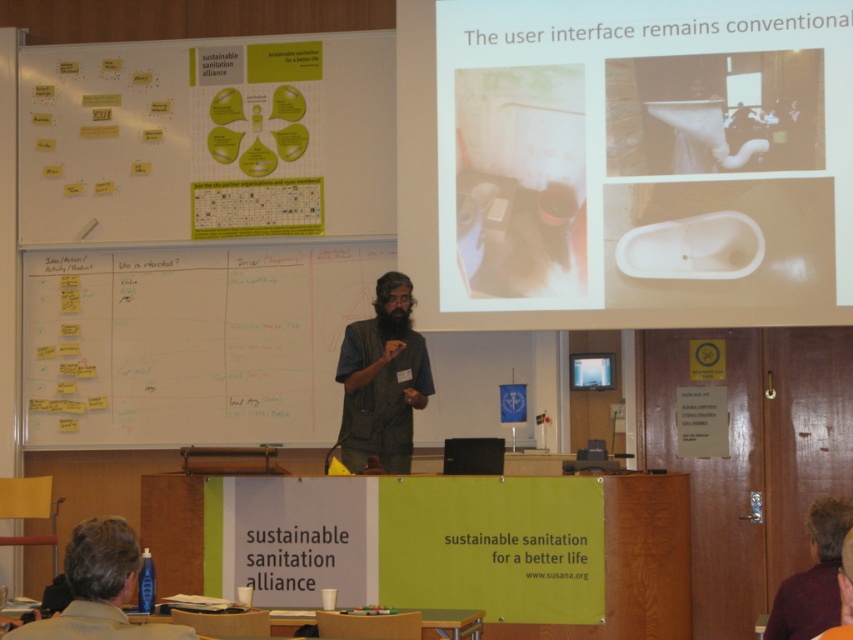
Can you confirm if brown hair at lower left is shorter than maroon fabric shirt at lower right?

Indeed, brown hair at lower left has a lesser height compared to maroon fabric shirt at lower right.

Is point (108, 627) farther from camera compared to point (827, 502)?

No, it is not.

Where is `brown hair at lower left`? The width and height of the screenshot is (853, 640). brown hair at lower left is located at coordinates (100, 588).

I want to click on brown cotton shirt at center, so click(381, 380).

I want to click on brown cotton shirt at center, so click(381, 380).

Does white plastic toilet at upper right appear under maroon fabric shirt at lower right?

Actually, white plastic toilet at upper right is above maroon fabric shirt at lower right.

This screenshot has width=853, height=640. What do you see at coordinates (628, 161) in the screenshot?
I see `white plastic toilet at upper right` at bounding box center [628, 161].

At what (x,y) coordinates should I click in order to perform the action: click on white plastic toilet at upper right. Please return your answer as a coordinate pair (x, y). The height and width of the screenshot is (640, 853). Looking at the image, I should click on (628, 161).